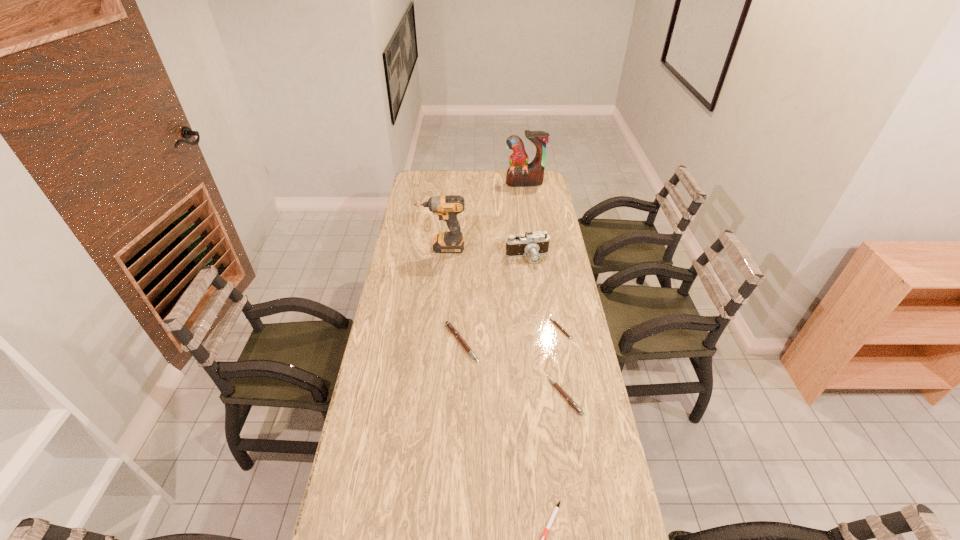
Where is `vacant region located at the lens of the fifth shortest object`? The image size is (960, 540). vacant region located at the lens of the fifth shortest object is located at coordinates (531, 284).

Where is `vacant space located 0.230m at the nib of the tallest pen`? vacant space located 0.230m at the nib of the tallest pen is located at coordinates (542, 343).

You are a GUI agent. You are given a task and a screenshot of the screen. Output one action in this format:
    pyautogui.click(x=<x>, y=<y>)
    Task: Click on the free region located 0.240m at the nib of the second biggest pink pen
    Image resolution: width=960 pixels, height=540 pixels.
    Given the screenshot: What is the action you would take?
    pyautogui.click(x=475, y=396)

Where is `vacant space located 0.050m at the nib of the second biggest pink pen`? vacant space located 0.050m at the nib of the second biggest pink pen is located at coordinates (534, 396).

Where is `vacant space located 0.400m at the nib of the second biggest pink pen`? vacant space located 0.400m at the nib of the second biggest pink pen is located at coordinates (427, 396).

Where is `vacant space located 0.090m at the nib of the smallest pink pen`? The image size is (960, 540). vacant space located 0.090m at the nib of the smallest pink pen is located at coordinates (526, 328).

The image size is (960, 540). I want to click on vacant area situated 0.170m at the nib of the smallest pink pen, so click(x=505, y=328).

Where is `vacant space situated at the nib of the smallest pink pen`? vacant space situated at the nib of the smallest pink pen is located at coordinates (534, 328).

This screenshot has width=960, height=540. I want to click on object that is at the far edge, so (520, 174).

I want to click on object at the left edge, so click(447, 207).